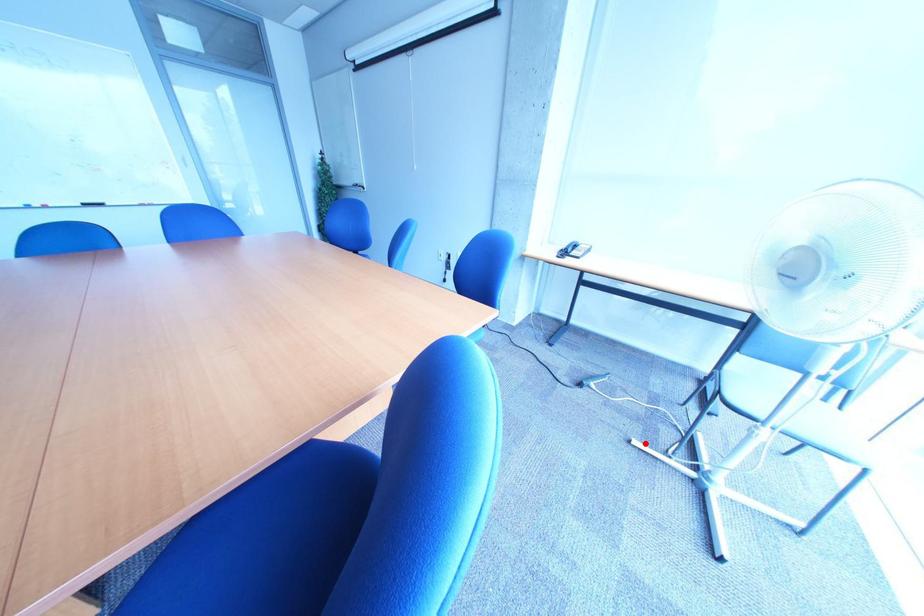
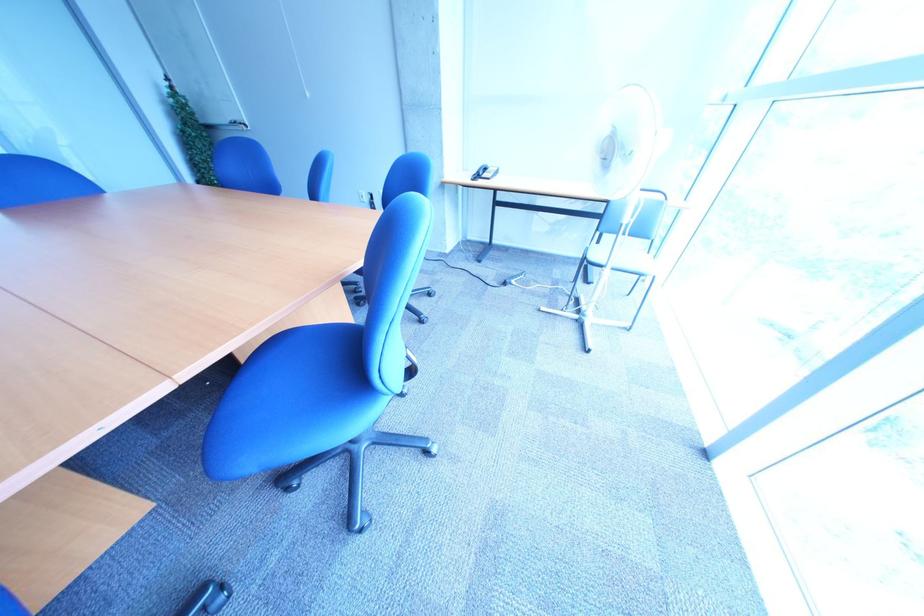
The point at the highlighted location is marked in the first image. Where is the corresponding point in the second image?

(554, 312)